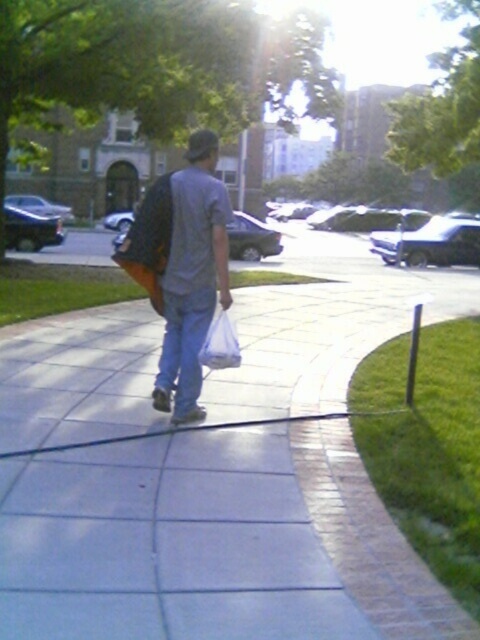
Question: Which object is positioned farthest from the white concrete sidewalk at center?

Choices:
 (A) matte gray shirt at center
 (B) white plastic bag at center

Answer: (A)

Question: Is matte gray shirt at center smaller than white plastic bag at center?

Choices:
 (A) no
 (B) yes

Answer: (A)

Question: Is white concrete sidewalk at center below matte gray shirt at center?

Choices:
 (A) no
 (B) yes

Answer: (B)

Question: Which is farther from the white concrete sidewalk at center?

Choices:
 (A) white plastic bag at center
 (B) matte gray shirt at center

Answer: (B)

Question: Considering the real-world distances, which object is closest to the white plastic bag at center?

Choices:
 (A) matte gray shirt at center
 (B) white concrete sidewalk at center

Answer: (A)

Question: Is white concrete sidewalk at center below white plastic bag at center?

Choices:
 (A) yes
 (B) no

Answer: (B)